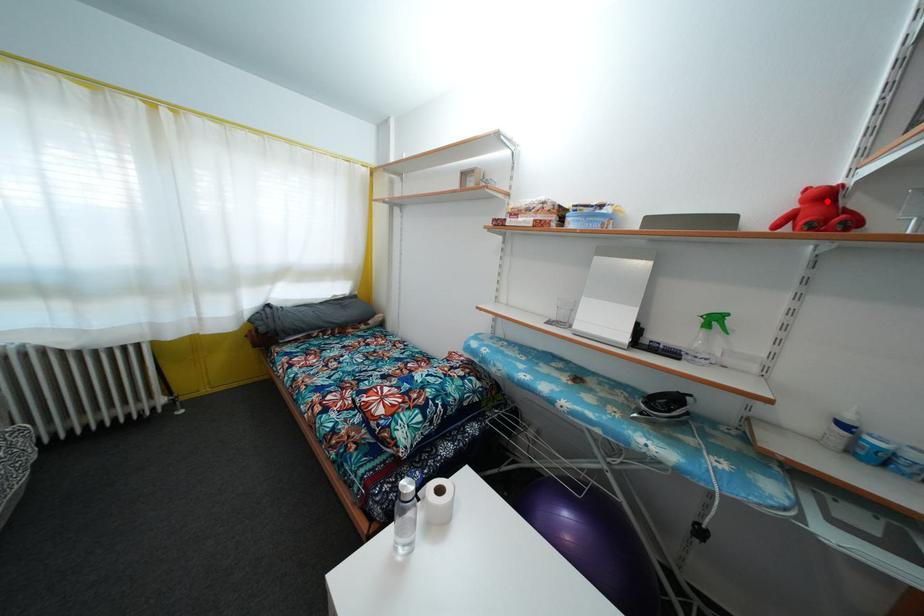
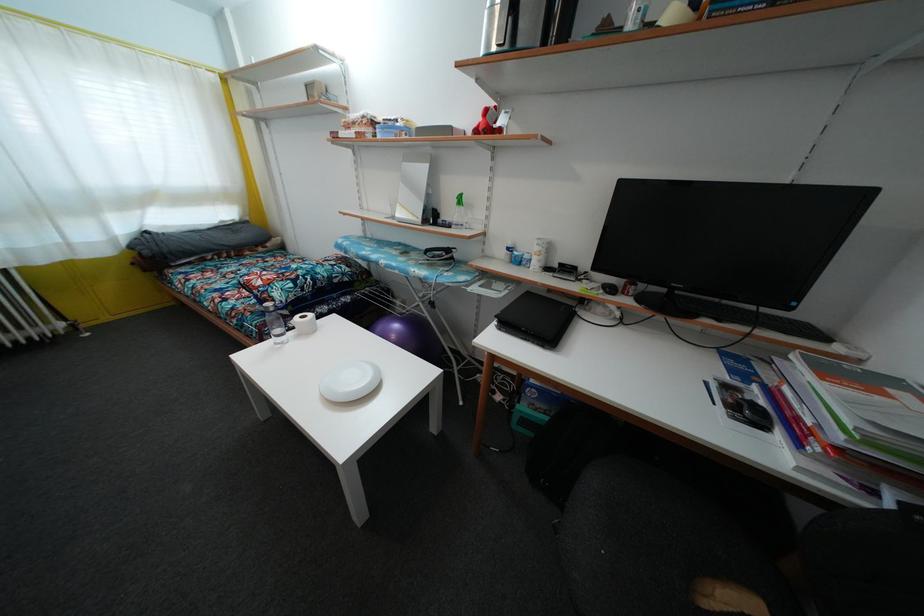
Question: I am providing you with two images of the same scene from different viewpoints. A red point is shown in image1. For the corresponding object point in image2, is it positioned nearer or farther from the camera?

Choices:
 (A) Nearer
 (B) Farther

Answer: (A)